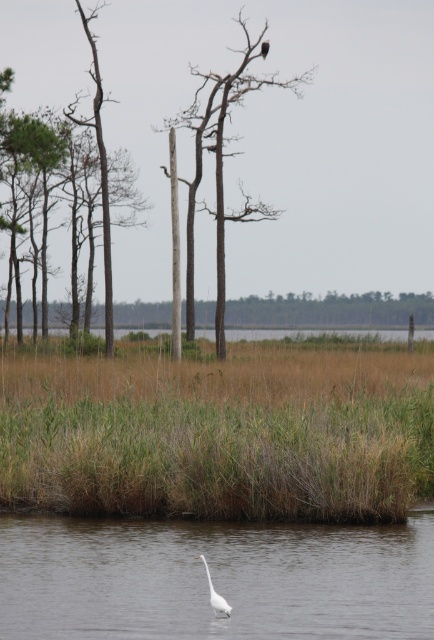
Question: Which is nearer to the white smooth water at lower center?

Choices:
 (A) white matte bird at lower center
 (B) brown wood tree at center

Answer: (A)

Question: Among these points, which one is farthest from the camera?

Choices:
 (A) (349, 561)
 (B) (200, 556)
 (C) (262, 56)

Answer: (C)

Question: Which of these objects is positioned farthest from the white matte bird at lower center?

Choices:
 (A) brown wood tree at center
 (B) white smooth water at lower center

Answer: (A)

Question: Is brown wood tree at center positioned at the back of white matte bird at lower center?

Choices:
 (A) yes
 (B) no

Answer: (A)

Question: Does white smooth water at lower center have a greater width compared to brown wood tree at center?

Choices:
 (A) yes
 (B) no

Answer: (B)

Question: Considering the relative positions of brown wood tree at center and white matte bird at lower center in the image provided, where is brown wood tree at center located with respect to white matte bird at lower center?

Choices:
 (A) left
 (B) right

Answer: (A)